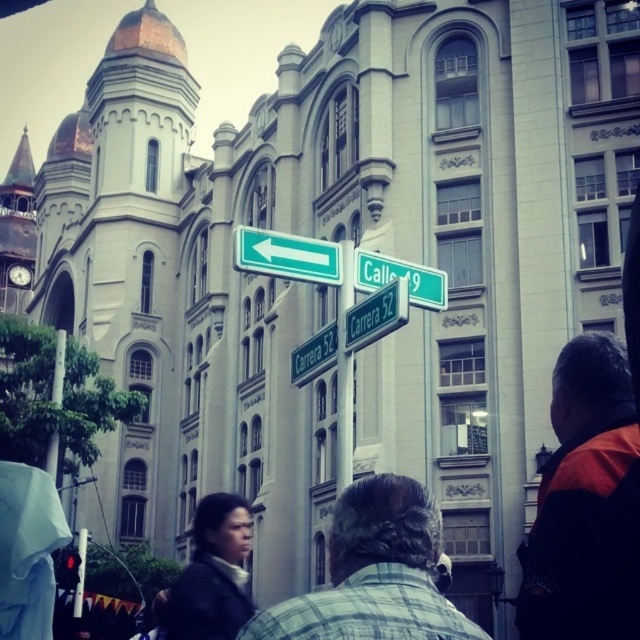
You are a delivery person who needs to carry both the dark brown leather jacket at lower left and the metallic pole at left. Given their sizes, which one should you place first in your vehicle to ensure both fit properly?

The dark brown leather jacket at lower left has a larger size compared to the metallic pole at left. To ensure both fit properly, you should place the dark brown leather jacket at lower left first in your vehicle, as it requires more space.

You are a delivery driver who needs to navigate through the city. You see the green matte street sign at upper center and the metallic pole at left. Which object is smaller in size?

The green matte street sign at upper center has a smaller size compared to the metallic pole at left.